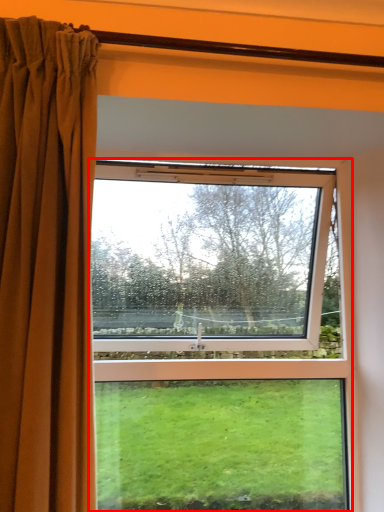
Question: From the image's perspective, what is the correct spatial relationship of window (annotated by the red box) in relation to curtain?

Choices:
 (A) below
 (B) above

Answer: (A)